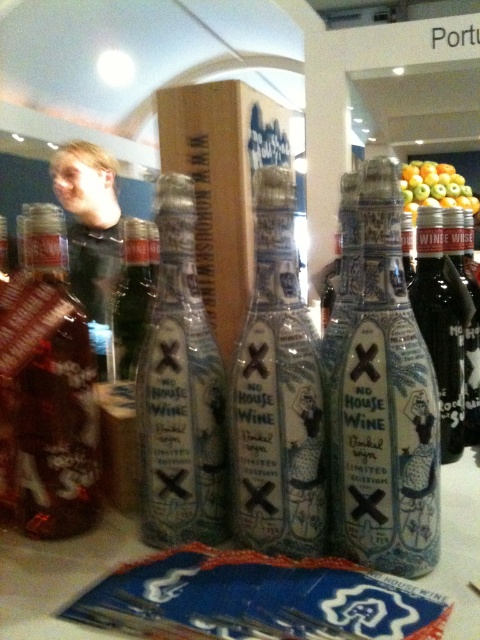
You are a customer at a wine store and see the black glass bottle at right and the matte black bottle at center. Which one can you reach without moving from your current position?

The black glass bottle at right is closer to the viewer than the matte black bottle at center, so you can reach the black glass bottle at right without moving.

You are standing in front of the display of No House Wine bottles. You need to find the black glass bottle at right. Where should you look relative to the main group of bottles on the table?

The black glass bottle at right is located at the right side of the image, specifically at the coordinates point (442, 324), so you should look to the right of the main group of bottles on the table to find it.